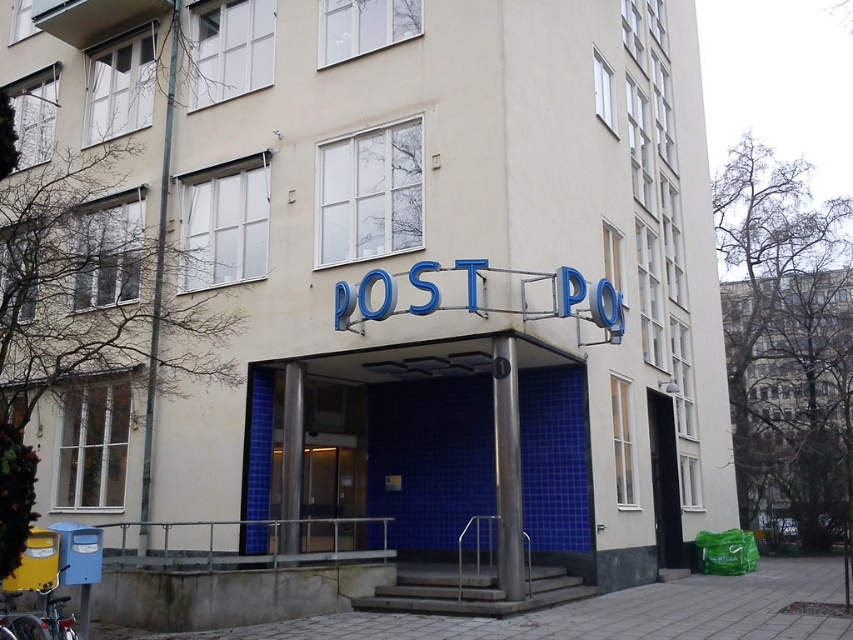
You are a delivery person approaching the entrance of the building. You need to place a large package on the ground in front of the blue tile building at center. Where should you place it so it doesn not block the glass door at center?

The blue tile building at center is positioned over the glass door at center, so placing the package in front of the blue tile building at center would block the glass door at center. Instead, place it to the side of the entrance to avoid blocking the door.

You are a delivery person who needs to enter the post office. You see the blue tile building at center and the black glass door at center. Which one is taller?

The blue tile building at center is taller than the black glass door at center.